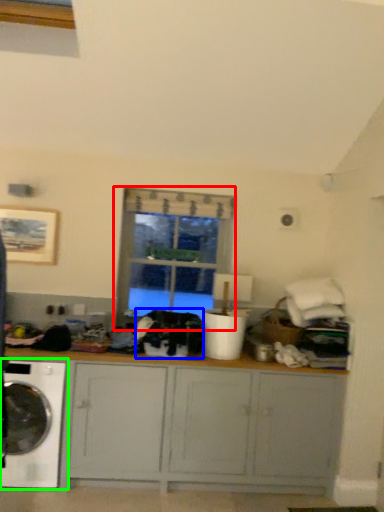
Question: Which object is the closest to the window (highlighted by a red box)? Choose among these: clothing (highlighted by a blue box) or washing machine (highlighted by a green box).

Choices:
 (A) clothing
 (B) washing machine

Answer: (A)